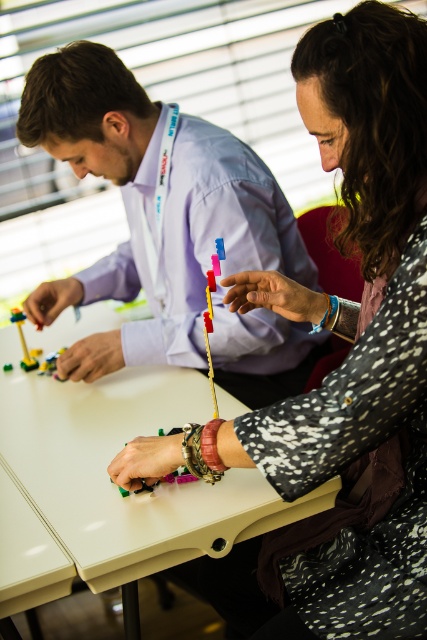
You are standing in front of the table where two people are building with LEGO bricks. You want to hand a LEGO piece to the person wearing the matte purple shirt at upper center. Since the white plastic table at center is between you and them, can you reach them without moving the table?

The matte purple shirt at upper center is further to the viewer than the white plastic table at center, so the table is actually behind the person. Therefore, you can reach them without moving the table because the table isn

You are organizing a small LEGO building competition and need to ensure that all participants have enough space to work. The table has limited space, and you notice the speckled fabric sweater at center and the translucent plastic toy at center. Which object should you move to free up more space for the LEGO builders?

The speckled fabric sweater at center has a larger size compared to the translucent plastic toy at center, so moving it would free up more space for the LEGO builders.